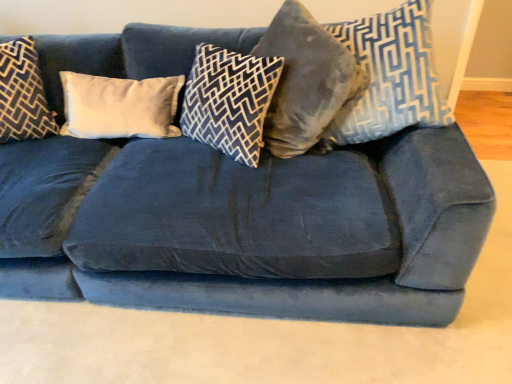
Question: Is velvet blue pillow at center, marked as the 3th pillow in a left-to-right arrangement, outside velvet blue pillow at upper right, the fifth pillow when ordered from left to right?

Choices:
 (A) yes
 (B) no

Answer: (A)

Question: Is velvet blue pillow at center, the third pillow from the right, facing away from velvet blue pillow at upper right, the fifth pillow when ordered from left to right?

Choices:
 (A) yes
 (B) no

Answer: (B)

Question: Considering the relative positions of velvet blue pillow at center, the third pillow from the right, and velvet blue pillow at upper right, the fifth pillow when ordered from left to right, in the image provided, is velvet blue pillow at center, the third pillow from the right, to the left of velvet blue pillow at upper right, the fifth pillow when ordered from left to right, from the viewer's perspective?

Choices:
 (A) no
 (B) yes

Answer: (B)

Question: From the image's perspective, is velvet blue pillow at center, marked as the 3th pillow in a left-to-right arrangement, located above velvet blue pillow at upper right, the fifth pillow when ordered from left to right?

Choices:
 (A) yes
 (B) no

Answer: (B)

Question: Is velvet blue pillow at center, the third pillow from the right, facing towards velvet blue pillow at upper right, which appears as the first pillow when viewed from the right?

Choices:
 (A) yes
 (B) no

Answer: (B)

Question: From the image's perspective, is velvet blue pillow at upper right, which appears as the first pillow when viewed from the right, located above or below velvet gray pillow at center, marked as the 2th pillow in a right-to-left arrangement?

Choices:
 (A) below
 (B) above

Answer: (B)

Question: Considering the positions of velvet blue pillow at upper right, which appears as the first pillow when viewed from the right, and velvet gray pillow at center, which ranks as the fourth pillow in left-to-right order, in the image, is velvet blue pillow at upper right, which appears as the first pillow when viewed from the right, wider or thinner than velvet gray pillow at center, which ranks as the fourth pillow in left-to-right order,?

Choices:
 (A) thin
 (B) wide

Answer: (B)

Question: From a real-world perspective, is velvet blue pillow at upper right, the fifth pillow when ordered from left to right, above or below velvet gray pillow at center, marked as the 2th pillow in a right-to-left arrangement?

Choices:
 (A) below
 (B) above

Answer: (B)

Question: Choose the correct answer: Is velvet blue pillow at upper right, the fifth pillow when ordered from left to right, inside velvet gray pillow at center, marked as the 2th pillow in a right-to-left arrangement, or outside it?

Choices:
 (A) outside
 (B) inside

Answer: (A)

Question: Is velvet blue pillow at center, marked as the 3th pillow in a left-to-right arrangement, taller or shorter than dark blue velvet pillow at left, which appears as the first pillow when viewed from the left?

Choices:
 (A) tall
 (B) short

Answer: (B)

Question: Looking at their shapes, would you say velvet blue pillow at center, the third pillow from the right, is wider or thinner than dark blue velvet pillow at left, the 5th pillow in the right-to-left sequence?

Choices:
 (A) wide
 (B) thin

Answer: (B)

Question: Looking at the image, does velvet blue pillow at center, marked as the 3th pillow in a left-to-right arrangement, seem bigger or smaller compared to dark blue velvet pillow at left, which appears as the first pillow when viewed from the left?

Choices:
 (A) big
 (B) small

Answer: (B)

Question: Considering the positions of point click(x=248, y=57) and point click(x=17, y=124), is point click(x=248, y=57) closer or farther from the camera than point click(x=17, y=124)?

Choices:
 (A) closer
 (B) farther

Answer: (A)

Question: Is velvet gray pillow at center, which ranks as the fourth pillow in left-to-right order, bigger or smaller than dark blue velvet pillow at left, which appears as the first pillow when viewed from the left?

Choices:
 (A) small
 (B) big

Answer: (B)

Question: Is velvet gray pillow at center, which ranks as the fourth pillow in left-to-right order, taller or shorter than dark blue velvet pillow at left, the 5th pillow in the right-to-left sequence?

Choices:
 (A) tall
 (B) short

Answer: (A)